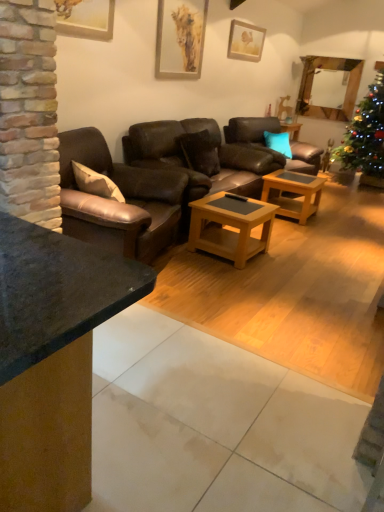
Question: Is matte gold picture frame at upper center, the 2th picture frame viewed from the right, inside woodenwoodencoffee table at center, the 1th coffee table in the front-to-back sequence?

Choices:
 (A) no
 (B) yes

Answer: (A)

Question: Considering the relative sizes of woodenwoodencoffee table at center, marked as the first coffee table in a left-to-right arrangement, and matte gold picture frame at upper center, the 2th picture frame viewed from the right, in the image provided, is woodenwoodencoffee table at center, marked as the first coffee table in a left-to-right arrangement, bigger than matte gold picture frame at upper center, the 2th picture frame viewed from the right,?

Choices:
 (A) yes
 (B) no

Answer: (A)

Question: Does woodenwoodencoffee table at center, the second coffee table from the right, turn towards matte gold picture frame at upper center, arranged as the 2th picture frame when viewed from the left?

Choices:
 (A) no
 (B) yes

Answer: (A)

Question: Is woodenwoodencoffee table at center, marked as the first coffee table in a left-to-right arrangement, oriented away from matte gold picture frame at upper center, the 2th picture frame viewed from the right?

Choices:
 (A) no
 (B) yes

Answer: (A)

Question: Is woodenwoodencoffee table at center, marked as the first coffee table in a left-to-right arrangement, positioned before matte gold picture frame at upper center, the second picture frame when ordered from back to front?

Choices:
 (A) yes
 (B) no

Answer: (A)

Question: Considering the relative positions of brown leather couch at center, the second studio couch when ordered from front to back, and teal fabric pillow at center, which is counted as the 2th pillow, starting from the left, in the image provided, is brown leather couch at center, the second studio couch when ordered from front to back, to the left or to the right of teal fabric pillow at center, which is counted as the 2th pillow, starting from the left,?

Choices:
 (A) right
 (B) left

Answer: (B)

Question: Is brown leather couch at center, which appears as the 1th studio couch when viewed from the back, bigger or smaller than teal fabric pillow at center, the 1th pillow when ordered from right to left?

Choices:
 (A) small
 (B) big

Answer: (B)

Question: From the image's perspective, is brown leather couch at center, the second studio couch when ordered from front to back, positioned above or below teal fabric pillow at center, marked as the 1th pillow in a back-to-front arrangement?

Choices:
 (A) above
 (B) below

Answer: (B)

Question: Is point (183, 144) closer or farther from the camera than point (271, 138)?

Choices:
 (A) closer
 (B) farther

Answer: (A)

Question: In the image, is wooden picture frame at upper left, arranged as the 1th picture frame when viewed from the front, positioned in front of or behind matte wooden picture frame at upper center, the 1th picture frame viewed from the right?

Choices:
 (A) front
 (B) behind

Answer: (A)

Question: From the image's perspective, is wooden picture frame at upper left, arranged as the 1th picture frame when viewed from the front, above or below matte wooden picture frame at upper center, the third picture frame from the left?

Choices:
 (A) above
 (B) below

Answer: (B)

Question: From a real-world perspective, is wooden picture frame at upper left, which is the 3th picture frame in right-to-left order, positioned above or below matte wooden picture frame at upper center, the 1th picture frame viewed from the back?

Choices:
 (A) below
 (B) above

Answer: (A)

Question: Would you say wooden picture frame at upper left, which ranks as the 1th picture frame in left-to-right order, is inside or outside matte wooden picture frame at upper center, the 1th picture frame viewed from the right?

Choices:
 (A) outside
 (B) inside

Answer: (A)

Question: Looking at their shapes, would you say teal fabric pillow at center, which is counted as the 2th pillow, starting from the left, is wider or thinner than woodenwoodencoffee table at center, the 1th coffee table positioned from the right?

Choices:
 (A) thin
 (B) wide

Answer: (A)

Question: Would you say teal fabric pillow at center, placed as the second pillow when sorted from front to back, is inside or outside woodenwoodencoffee table at center, which is the second coffee table in left-to-right order?

Choices:
 (A) inside
 (B) outside

Answer: (B)